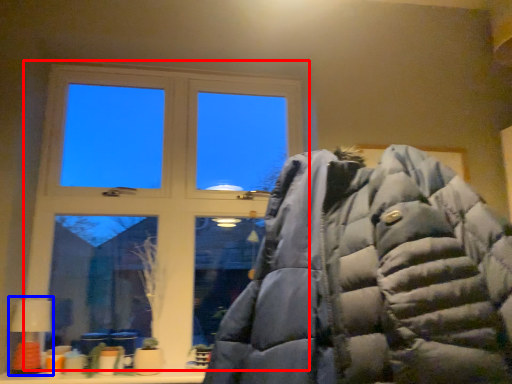
Question: Which point is further to the camera, window (highlighted by a red box) or table lamp (highlighted by a blue box)?

Choices:
 (A) window
 (B) table lamp

Answer: (A)